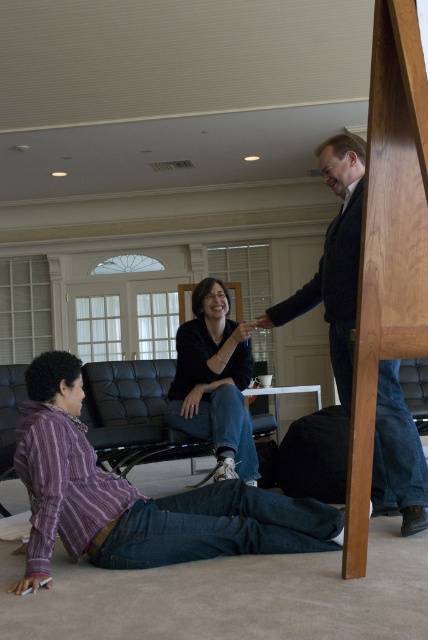
Question: Is dark brown wood chair at right wider than black matte/black jeans at center?

Choices:
 (A) no
 (B) yes

Answer: (B)

Question: Which of the following is the farthest from the observer?

Choices:
 (A) black matte/black jeans at center
 (B) purple striped shirt at lower left

Answer: (A)

Question: Which object is the farthest from the black matte/black jeans at center?

Choices:
 (A) dark brown wood chair at right
 (B) purple striped shirt at lower left

Answer: (B)

Question: Is dark brown wood chair at right smaller than black matte/black jeans at center?

Choices:
 (A) yes
 (B) no

Answer: (B)

Question: Can you confirm if purple striped shirt at lower left is bigger than black matte/black jeans at center?

Choices:
 (A) no
 (B) yes

Answer: (A)

Question: Which of the following is the closest to the observer?

Choices:
 (A) dark brown wood chair at right
 (B) black matte/black jeans at center
 (C) purple striped shirt at lower left

Answer: (C)